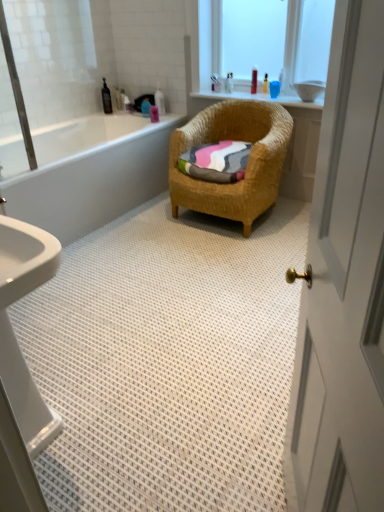
The image size is (384, 512). I want to click on free spot in front of translucent plastic bottle at upper center, the first toiletry positioned from the right, so 258,96.